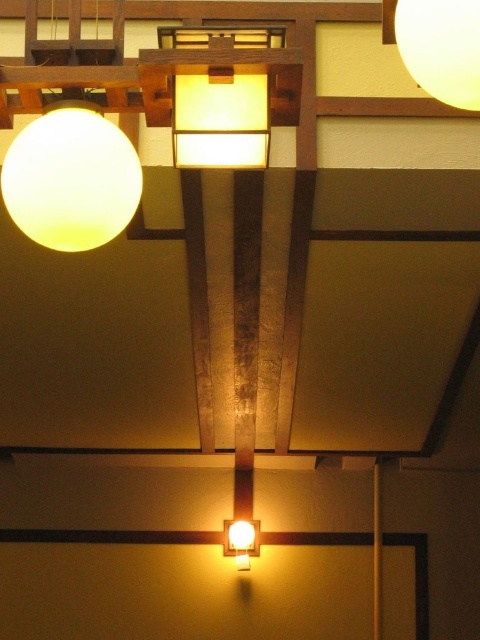
Question: Based on their relative distances, which object is farther from the matte white sphere at upper left?

Choices:
 (A) matte white sphere at upper right
 (B) matte wood panel at upper center
 (C) matte white bulb at lower center

Answer: (C)

Question: Based on their relative distances, which object is farther from the matte white sphere at upper right?

Choices:
 (A) matte white bulb at lower center
 (B) matte white sphere at upper left
 (C) matte wood panel at upper center

Answer: (A)

Question: Does matte white sphere at upper left lie in front of matte white sphere at upper right?

Choices:
 (A) yes
 (B) no

Answer: (B)

Question: Which object appears farthest from the camera in this image?

Choices:
 (A) matte white bulb at lower center
 (B) matte white sphere at upper right
 (C) matte wood panel at upper center

Answer: (A)

Question: Can you confirm if matte wood panel at upper center is positioned to the right of matte white sphere at upper right?

Choices:
 (A) yes
 (B) no

Answer: (B)

Question: Does matte white sphere at upper left appear under matte white bulb at lower center?

Choices:
 (A) yes
 (B) no

Answer: (B)